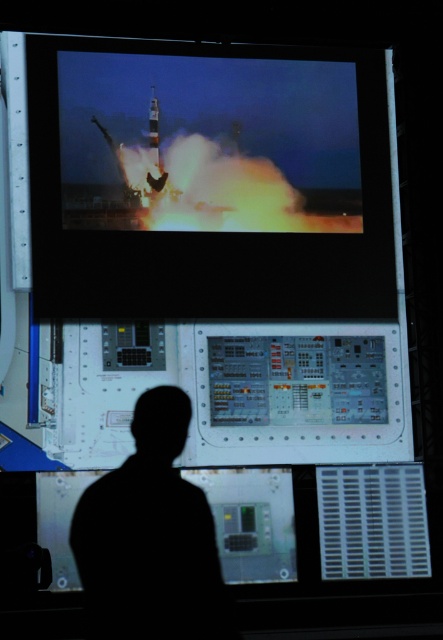
Which of these two, black matte silhouette at center or shiny metallic missile at upper center, stands taller?

black matte silhouette at center is taller.

Is point (108, 625) positioned after point (155, 147)?

No, it is not.

Describe the element at coordinates (151, 538) in the screenshot. I see `black matte silhouette at center` at that location.

The image size is (443, 640). What are the coordinates of `black matte silhouette at center` in the screenshot? It's located at (151, 538).

Is matte black rocket at upper center in front of shiny metallic missile at upper center?

Yes, matte black rocket at upper center is in front of shiny metallic missile at upper center.

In the scene shown: Is matte black rocket at upper center thinner than shiny metallic missile at upper center?

Incorrect, matte black rocket at upper center's width is not less than shiny metallic missile at upper center's.

Does point (92, 221) come closer to viewer compared to point (154, 102)?

Yes, it is.

You are a GUI agent. You are given a task and a screenshot of the screen. Output one action in this format:
    pyautogui.click(x=<x>, y=<y>)
    Task: Click on the matte black rocket at upper center
    Image resolution: width=443 pixels, height=640 pixels.
    Given the screenshot: What is the action you would take?
    pyautogui.click(x=209, y=180)

Between matte black rocket at upper center and black matte silhouette at center, which one appears on the left side from the viewer's perspective?

From the viewer's perspective, black matte silhouette at center appears more on the left side.

Who is more distant from viewer, (x=302, y=173) or (x=159, y=614)?

Positioned behind is point (x=302, y=173).

Image resolution: width=443 pixels, height=640 pixels. Identify the location of matte black rocket at upper center. (209, 180).